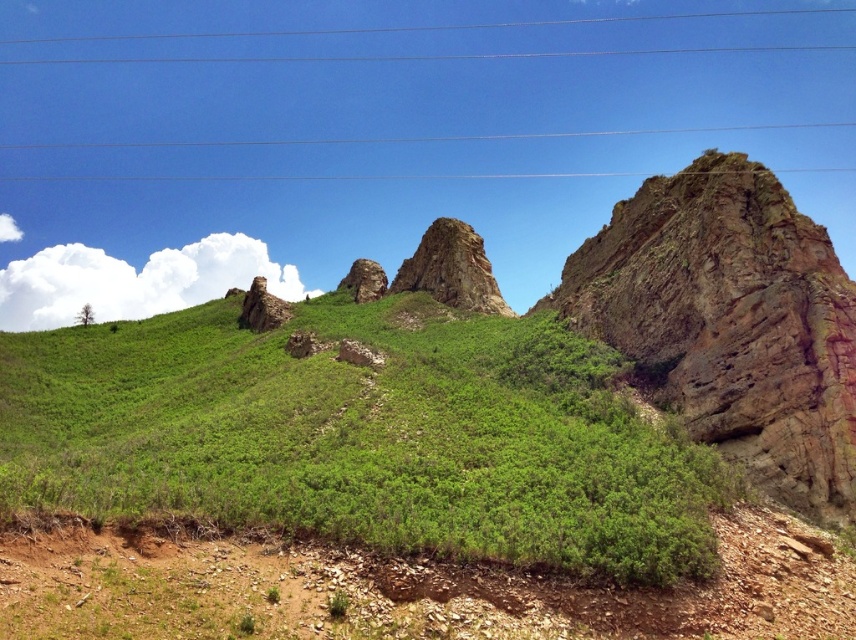
Does point (229, 316) come behind point (464, 284)?

Yes, point (229, 316) is farther from viewer.

Which is more to the left, green leafy grass at center or rusty rock formation at center?

green leafy grass at center is more to the left.

Find the location of a particular element. This screenshot has width=856, height=640. green leafy grass at center is located at coordinates (361, 436).

Find the location of a particular element. green leafy grass at center is located at coordinates (361, 436).

Which is more to the left, metallic wires at upper center or rusty rock formation at center?

Positioned to the left is metallic wires at upper center.

Can you confirm if metallic wires at upper center is positioned to the right of rusty rock formation at center?

Incorrect, metallic wires at upper center is not on the right side of rusty rock formation at center.

Is point (187, 145) closer to viewer compared to point (456, 285)?

No, it is not.

Where is `metallic wires at upper center`? metallic wires at upper center is located at coordinates (428, 26).

Does green leafy grass at center have a lesser height compared to metallic wires at upper center?

Yes, green leafy grass at center is shorter than metallic wires at upper center.

Does green leafy grass at center appear over metallic wires at upper center?

No.

Is point (321, 502) closer to viewer compared to point (421, 54)?

Yes, it is in front of point (421, 54).

Locate an element on the screen. green leafy grass at center is located at coordinates (361, 436).